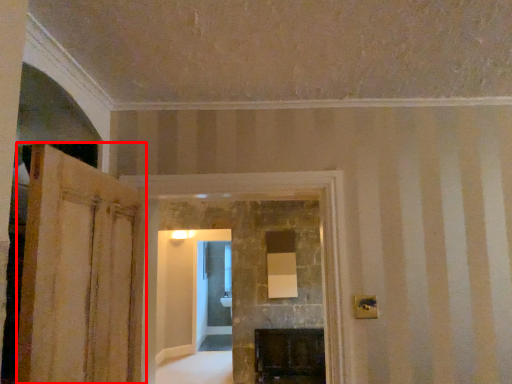
Question: Where is door (annotated by the red box) located in relation to fireplace in the image?

Choices:
 (A) right
 (B) left

Answer: (B)